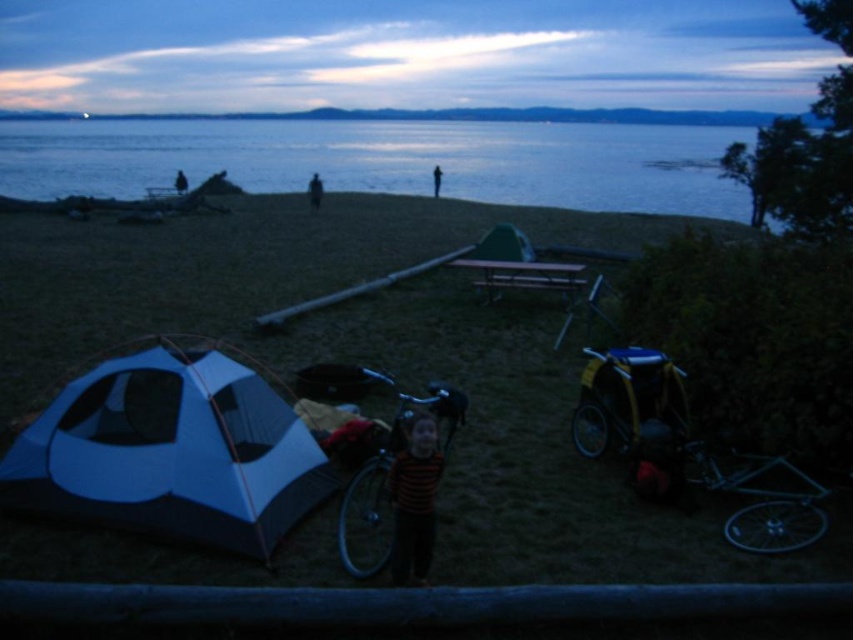
Question: Which of the following is the closest to the observer?

Choices:
 (A) striped fabric at center
 (B) blue fabric tent at lower left

Answer: (A)

Question: Which point is farther from the camera taking this photo?

Choices:
 (A) (431, 544)
 (B) (178, 193)
 (C) (219, 403)

Answer: (B)

Question: Can you confirm if striped fabric at center is positioned to the left of dark fabric person at center?

Choices:
 (A) no
 (B) yes

Answer: (A)

Question: Does blue fabric tent at lower left appear under dark fabric person at center?

Choices:
 (A) yes
 (B) no

Answer: (A)

Question: Can you confirm if dark blue fabric tent at center is positioned below dark blue jeans at center?

Choices:
 (A) yes
 (B) no

Answer: (B)

Question: Which of the following is the closest to the observer?

Choices:
 (A) (410, 474)
 (B) (311, 493)

Answer: (A)